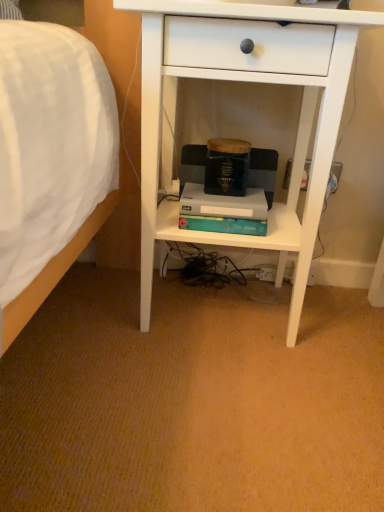
Question: In terms of size, does teal matte paperback book at center appear bigger or smaller than white matte desk at center?

Choices:
 (A) small
 (B) big

Answer: (A)

Question: Would you say teal matte paperback book at center is to the left or to the right of white matte desk at center in the picture?

Choices:
 (A) right
 (B) left

Answer: (B)

Question: From the image's perspective, relative to white matte desk at center, is teal matte paperback book at center above or below?

Choices:
 (A) below
 (B) above

Answer: (A)

Question: In the image, is white matte desk at center positioned in front of or behind teal matte paperback book at center?

Choices:
 (A) behind
 (B) front

Answer: (B)

Question: Considering the relative positions of white matte desk at center and teal matte paperback book at center in the image provided, is white matte desk at center to the left or to the right of teal matte paperback book at center?

Choices:
 (A) right
 (B) left

Answer: (A)

Question: Is white matte desk at center inside the boundaries of teal matte paperback book at center, or outside?

Choices:
 (A) inside
 (B) outside

Answer: (B)

Question: Does point (187, 58) appear closer or farther from the camera than point (196, 214)?

Choices:
 (A) farther
 (B) closer

Answer: (B)